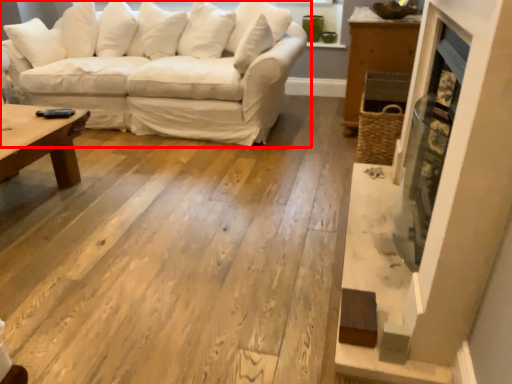
Question: Where is studio couch (annotated by the red box) located in relation to fireplace in the image?

Choices:
 (A) left
 (B) right

Answer: (A)